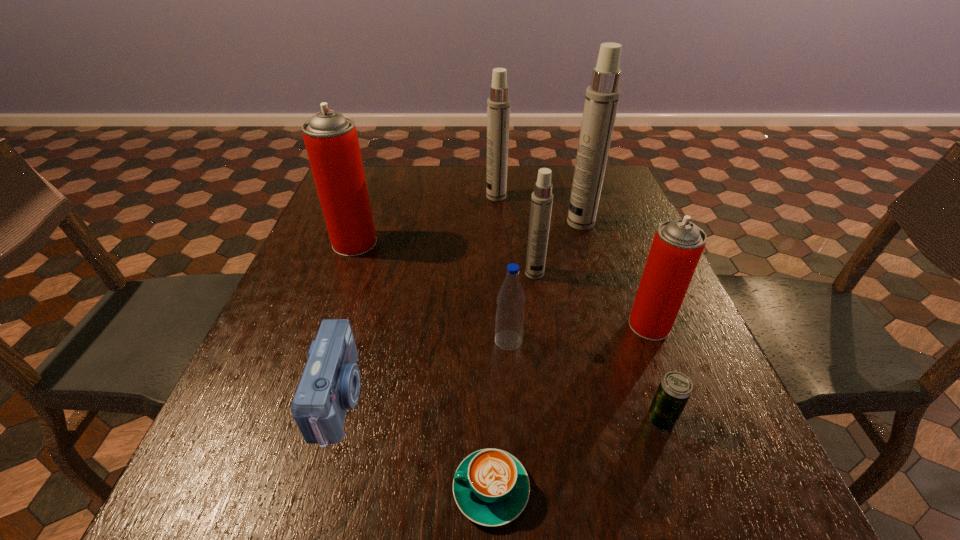
Point out which aerosol can is positioned as the nearest to the beer can. Please provide its 2D coordinates. Your answer should be formatted as a tuple, i.e. [(x, y)], where the tuple contains the x and y coordinates of a point satisfying the conditions above.

[(677, 246)]

Identify the location of aerosol can object that ranks as the closest to the camera. Image resolution: width=960 pixels, height=540 pixels. (331, 140).

This screenshot has height=540, width=960. Identify the location of white aerosol can that is the nearest to the second white aerosol can from left to right. (602, 97).

You are a GUI agent. You are given a task and a screenshot of the screen. Output one action in this format:
    pyautogui.click(x=<x>, y=<y>)
    Task: Click on the white aerosol can that stands as the second closest to the farthest white aerosol can
    The image size is (960, 540).
    Given the screenshot: What is the action you would take?
    pyautogui.click(x=542, y=198)

Locate an element on the screen. This screenshot has height=540, width=960. free space that satisfies the following two spatial constraints: 1. on the front side of the beer can; 2. on the right side of the fourth farthest aerosol can is located at coordinates (556, 420).